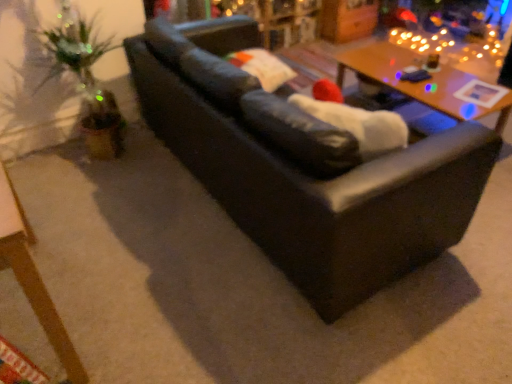
Find the location of a particular element. vacant area that is in front of matte black couch at center is located at coordinates (261, 311).